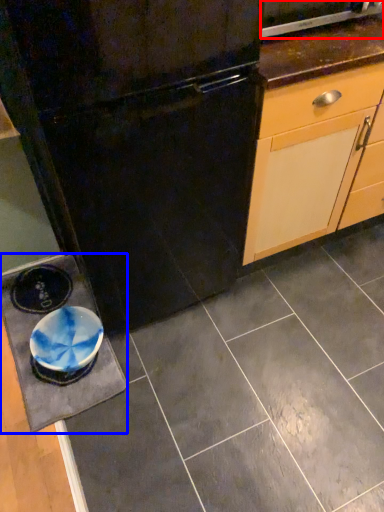
Question: Which object appears farthest to the camera in this image, home appliance (highlighted by a red box) or slate (highlighted by a blue box)?

Choices:
 (A) home appliance
 (B) slate

Answer: (B)